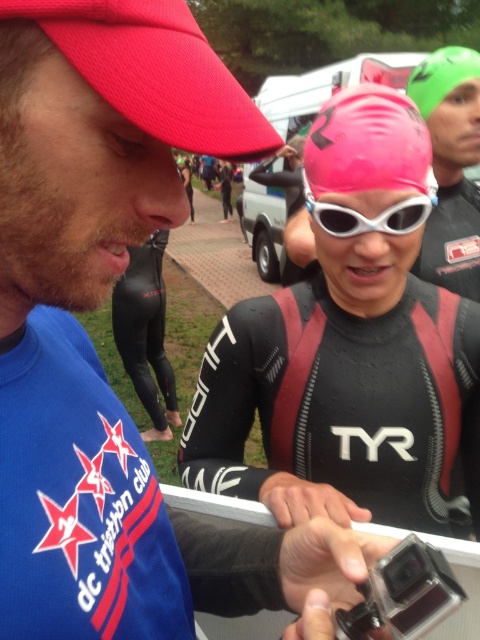
Question: Is pink matte swim cap at center below white matte goggles at center?

Choices:
 (A) no
 (B) yes

Answer: (A)

Question: Which is nearer to the matte red baseball cap at upper left?

Choices:
 (A) white matte goggles at center
 (B) pink matte swim cap at center

Answer: (B)

Question: Which point appears closest to the camera in this image?

Choices:
 (A) (346, 148)
 (B) (145, 6)

Answer: (B)

Question: Does matte red baseball cap at upper left appear on the right side of pink matte swim cap at center?

Choices:
 (A) no
 (B) yes

Answer: (A)

Question: Which of the following is the farthest from the observer?

Choices:
 (A) white matte goggles at center
 (B) green matte swim cap at upper right

Answer: (B)

Question: Is white matte goggles at center smaller than green matte swim cap at upper right?

Choices:
 (A) no
 (B) yes

Answer: (B)